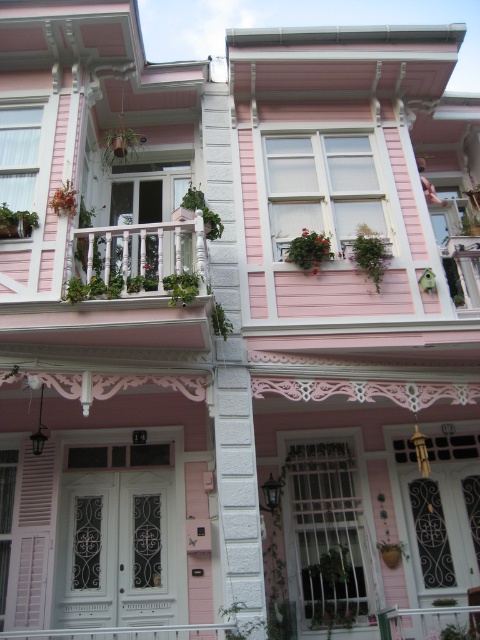
Question: In this image, where is white wooden railing at center located relative to pink matte shutter at lower left?

Choices:
 (A) below
 (B) above

Answer: (B)

Question: Which point appears closest to the camera in this image?

Choices:
 (A) (191, 257)
 (B) (4, 602)
 (C) (411, 620)

Answer: (A)

Question: Does white wooden railing at center appear on the right side of white painted wood porch at lower center?

Choices:
 (A) yes
 (B) no

Answer: (A)

Question: Which point is farther to the camera?

Choices:
 (A) 56,637
 (B) 132,248
 (C) 121,262

Answer: (B)

Question: Considering the real-world distances, which object is farthest from the white painted wood porch at lower center?

Choices:
 (A) white wooden railing at center
 (B) white wooden balcony at center

Answer: (A)

Question: Can you confirm if pink matte shutter at lower left is thinner than white painted wood porch at lower center?

Choices:
 (A) no
 (B) yes

Answer: (A)